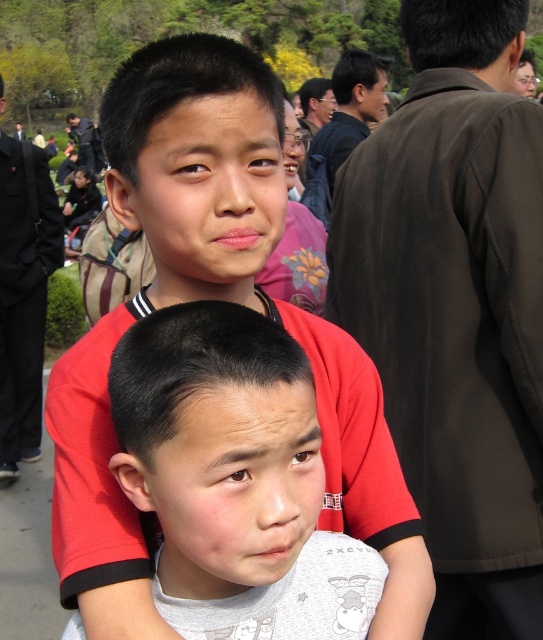
Is matte red shirt at center to the right of gray cotton shirt at center from the viewer's perspective?

Incorrect, matte red shirt at center is not on the right side of gray cotton shirt at center.

Does matte red shirt at center appear over gray cotton shirt at center?

Yes.

This screenshot has height=640, width=543. What are the coordinates of `matte red shirt at center` in the screenshot? It's located at (211, 298).

Which is behind, point (381, 172) or point (135, 356)?

Point (381, 172)

Who is more forward, (451, 156) or (249, 451)?

Positioned in front is point (249, 451).

Image resolution: width=543 pixels, height=640 pixels. Identify the location of brown fabric shoulder at upper right. [x=457, y=307].

Which is more to the left, brown fabric shoulder at upper right or matte red shirt at center?

Positioned to the left is matte red shirt at center.

Does brown fabric shoulder at upper right have a lesser width compared to matte red shirt at center?

Correct, brown fabric shoulder at upper right's width is less than matte red shirt at center's.

You are a GUI agent. You are given a task and a screenshot of the screen. Output one action in this format:
    pyautogui.click(x=<x>, y=<y>)
    Task: Click on the brown fabric shoulder at upper right
    Image resolution: width=543 pixels, height=640 pixels.
    Given the screenshot: What is the action you would take?
    pyautogui.click(x=457, y=307)

You are a GUI agent. You are given a task and a screenshot of the screen. Output one action in this format:
    pyautogui.click(x=<x>, y=<y>)
    Task: Click on the brown fabric shoulder at upper right
    The image size is (543, 640).
    Given the screenshot: What is the action you would take?
    [457, 307]